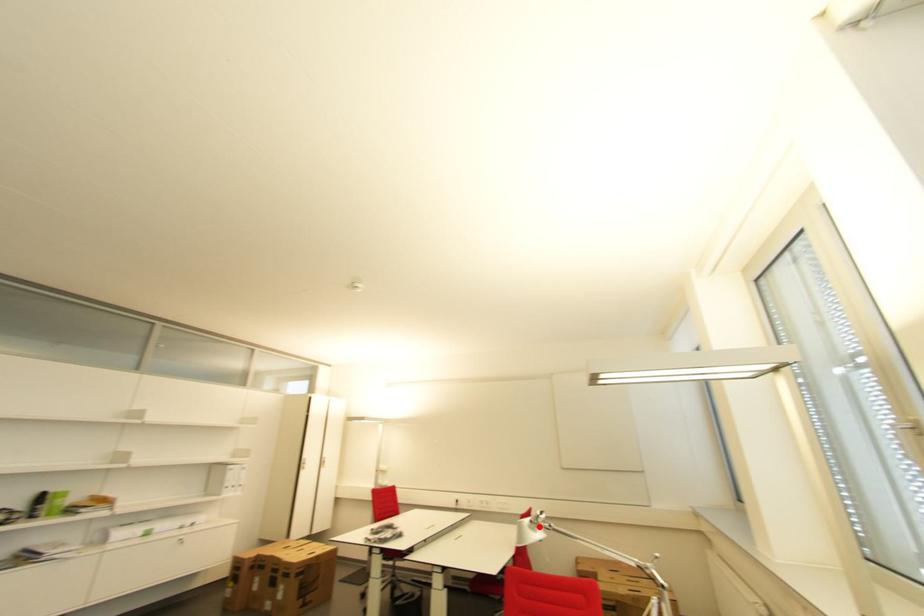
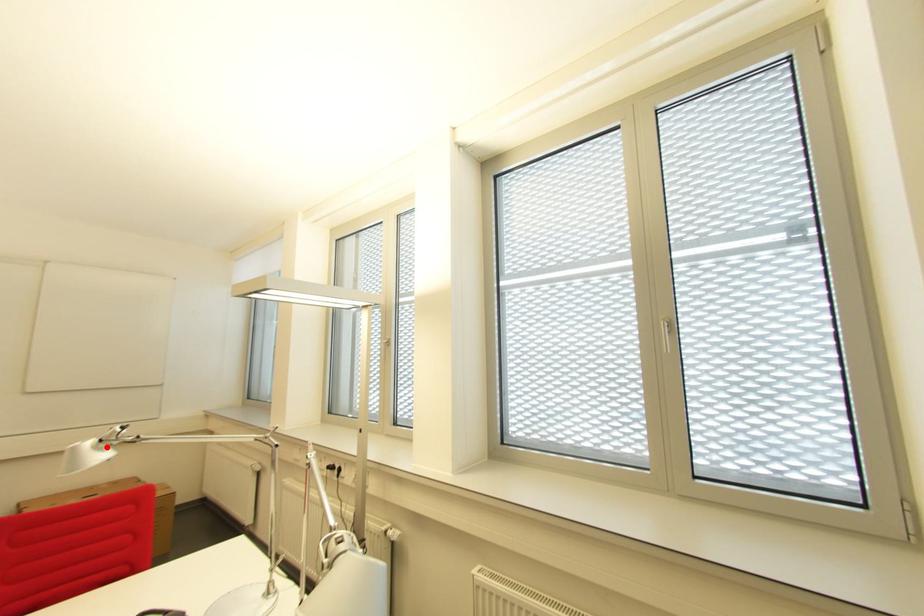
I am providing you with two images of the same scene from different viewpoints. A red point is marked on the first image and another point is marked on the second image. Is the red point in image1 aligned with the point shown in image2?

Yes